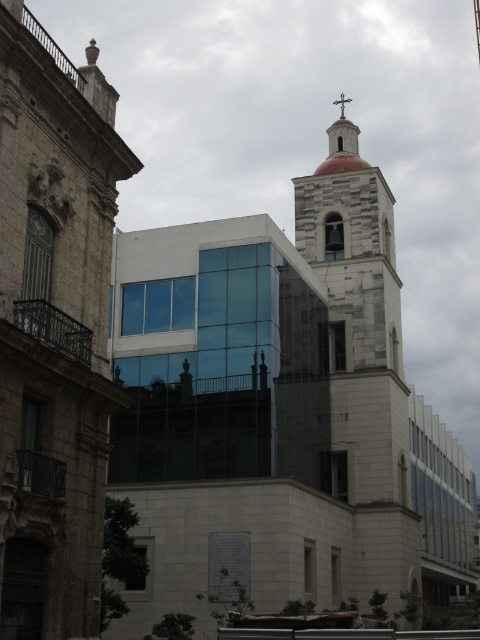
Question: Does white stone church at center come in front of green metallic cross at upper center?

Choices:
 (A) yes
 (B) no

Answer: (A)

Question: Which of the following is the closest to the observer?

Choices:
 (A) green metallic cross at upper center
 (B) white stone church at center

Answer: (B)

Question: Observing the image, what is the correct spatial positioning of white stone church at center in reference to green metallic cross at upper center?

Choices:
 (A) right
 (B) left

Answer: (B)

Question: Which object is farther from the camera taking this photo?

Choices:
 (A) green metallic cross at upper center
 (B) white stone church at center

Answer: (A)

Question: Does white stone church at center appear on the left side of green metallic cross at upper center?

Choices:
 (A) yes
 (B) no

Answer: (A)